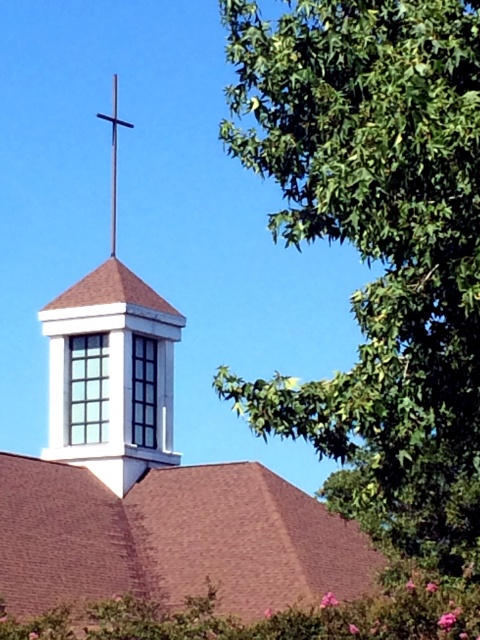
You are a drone operator planning to fly a drone with a wingspan of 1.2 meters between the white matte steeple at center and the black metal cross at upper center. Based on the distance between them, will the drone be able to pass through the space between these two objects?

The white matte steeple at center and black metal cross at upper center are 53.91 meters apart from each other. Since the drone has a wingspan of 1.2 meters, it can easily pass through the space between them as the distance is much larger than the drone size.

You are standing in front of the church and want to take a photo of the white matte steeple at center and the white matte cross at upper center. If your camera can only focus on objects within 5 meters, will both objects be in focus?

The white matte steeple at center is 7.69 meters away from the white matte cross at upper center. Since the distance between them is greater than 5 meters, the camera might not be able to focus on both objects simultaneously if they are at different distances from the camera. However, the question states the camera can focus on objects within 5 meters, but it is unclear if this refers to the distance from the camera to each object or between the objects. Assuming the camera is positioned such that both are

You are standing in front of the church and want to take a photo of the white matte steeple at center. Given that the steeple is positioned at coordinates 0.755 on the x axis and 0.317 on the y axis, will it be centered in your camera frame?

The white matte steeple at center is located at point (152,483), which means it is not exactly at the center of the image since the center coordinates would typically be around (240,320). Therefore, it will not be perfectly centered in your camera frame.